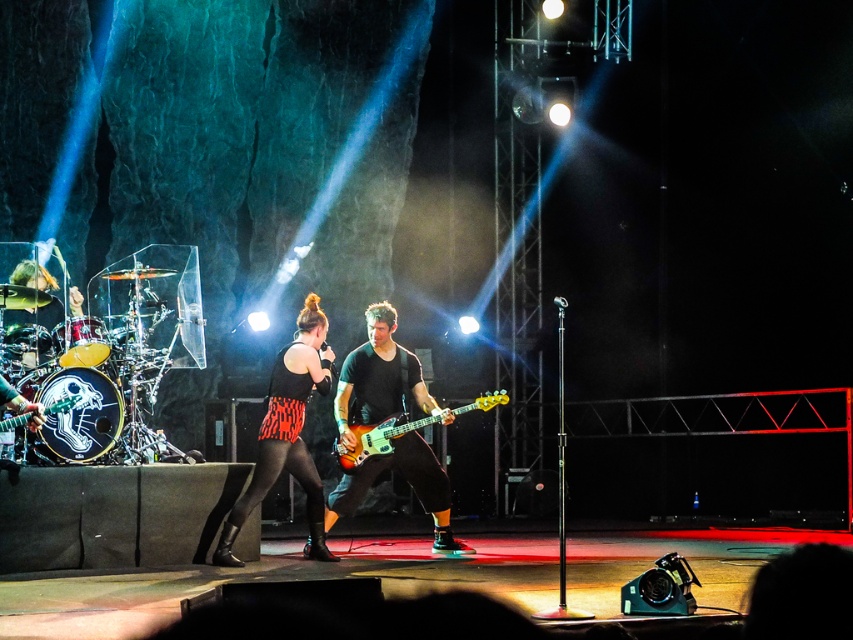
Question: Which point is closer to the camera?

Choices:
 (A) shiny orange wood bass guitar at center
 (B) shiny orange bass guitar at center

Answer: (A)

Question: Among these objects, which one is farthest from the camera?

Choices:
 (A) shiny orange bass guitar at center
 (B) shiny orange wood bass guitar at center
 (C) zebra print dress at center
 (D) shiny metallic guitar at left

Answer: (A)

Question: Among these points, which one is nearest to the camera?

Choices:
 (A) (312, 305)
 (B) (4, 428)

Answer: (B)

Question: Can you confirm if shiny orange bass guitar at center is wider than shiny metallic guitar at left?

Choices:
 (A) no
 (B) yes

Answer: (B)

Question: Does shiny orange wood bass guitar at center have a greater width compared to shiny metallic guitar at left?

Choices:
 (A) no
 (B) yes

Answer: (B)

Question: Can you confirm if zebra print dress at center is positioned to the right of shiny orange wood bass guitar at center?

Choices:
 (A) yes
 (B) no

Answer: (B)